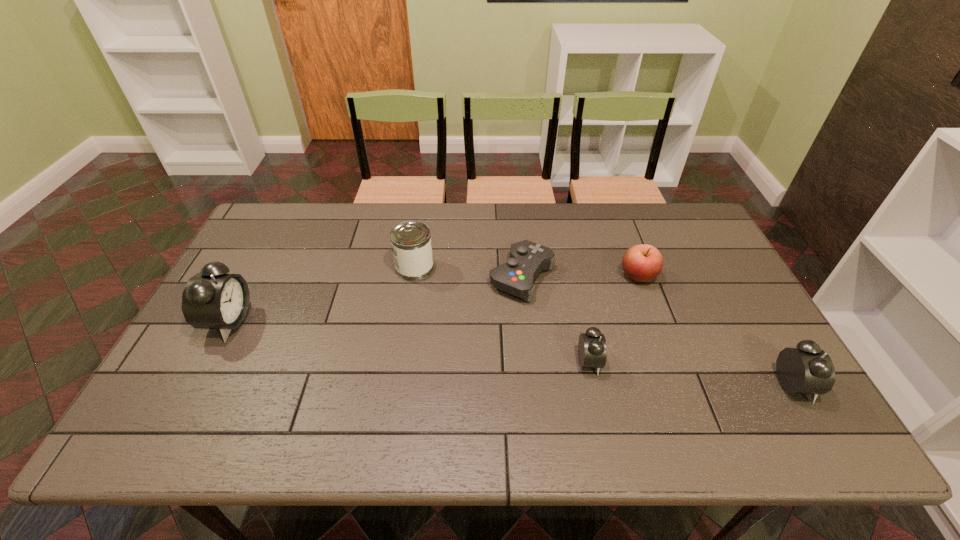
In the image, there is a desktop. Where is `free space at the left edge`? free space at the left edge is located at coordinates 194,352.

Identify the location of vacant space at the right edge of the desktop. click(x=730, y=307).

In the image, there is a desktop. Identify the location of vacant region at the far left corner. The width and height of the screenshot is (960, 540). (298, 215).

This screenshot has width=960, height=540. What are the coordinates of `vacant space at the far right corner of the desktop` in the screenshot? It's located at (688, 228).

You are a GUI agent. You are given a task and a screenshot of the screen. Output one action in this format:
    pyautogui.click(x=<x>, y=<y>)
    Task: Click on the vacant region at the near right corner of the desktop
    The image size is (960, 540).
    Given the screenshot: What is the action you would take?
    pyautogui.click(x=776, y=390)

The height and width of the screenshot is (540, 960). Identify the location of free space between the fifth object from left to right and the leftmost alarm clock. (434, 299).

The height and width of the screenshot is (540, 960). I want to click on blank region between the shortest alarm clock and the rightmost alarm clock, so click(x=691, y=373).

I want to click on blank region between the control and the second object from right to left, so click(x=580, y=276).

Find the location of a particular element. vacant area between the shortest alarm clock and the can is located at coordinates (502, 315).

Locate an element on the screen. The height and width of the screenshot is (540, 960). vacant point located between the leftmost object and the fourth object from right to left is located at coordinates (375, 299).